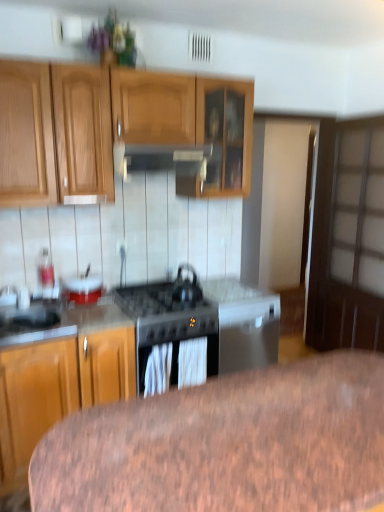
Identify the location of free location above brown wood table at lower center (from a real-world perspective). The image size is (384, 512). (240, 436).